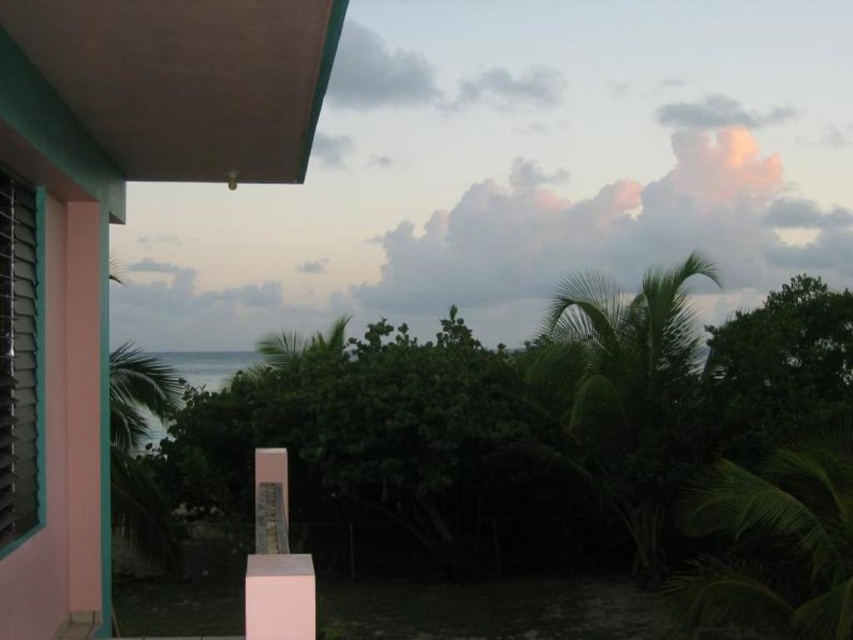
Question: Among these points, which one is nearest to the camera?

Choices:
 (A) (755, 573)
 (B) (656, 314)

Answer: (A)

Question: Is pink concrete balcony at upper left thinner than green leafy palm tree at center?

Choices:
 (A) no
 (B) yes

Answer: (A)

Question: Which point is farther to the camera?

Choices:
 (A) [813, 545]
 (B) [648, 321]

Answer: (B)

Question: Which point appears farthest from the camera in this image?

Choices:
 (A) (646, 465)
 (B) (810, 595)
 (C) (103, 476)

Answer: (A)

Question: In this image, where is green leafy palm tree at right located relative to green leafy palm tree at center?

Choices:
 (A) right
 (B) left

Answer: (B)

Question: Is pink concrete balcony at upper left to the right of green leafy palm tree at center from the viewer's perspective?

Choices:
 (A) yes
 (B) no

Answer: (B)